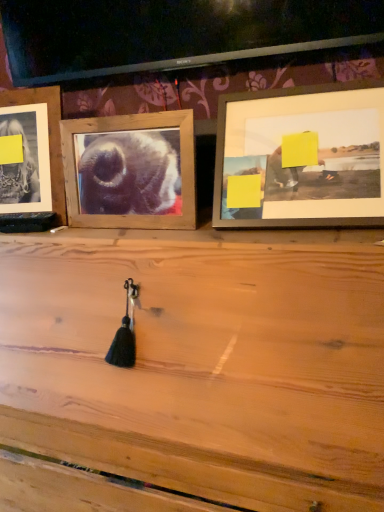
Describe the element at coordinates (49, 135) in the screenshot. I see `wooden frame at left, the third picture frame in the right-to-left sequence` at that location.

What is the approximate width of wooden frame at left, the third picture frame in the right-to-left sequence?

wooden frame at left, the third picture frame in the right-to-left sequence, is 7.25 inches in width.

This screenshot has width=384, height=512. I want to click on wooden picture frame at upper right, which appears as the first picture frame when viewed from the right, so click(x=301, y=157).

How many degrees apart are the facing directions of wooden picture frame at upper right, which appears as the first picture frame when viewed from the right, and wooden frame at left, the third picture frame in the right-to-left sequence?

They differ by 5.94 degrees in their facing directions.

Choose the correct answer: Is wooden picture frame at upper right, the third picture frame when ordered from left to right, inside wooden frame at left, the third picture frame in the right-to-left sequence, or outside it?

wooden picture frame at upper right, the third picture frame when ordered from left to right, is located beyond the bounds of wooden frame at left, the third picture frame in the right-to-left sequence.

Between wooden picture frame at upper right, which appears as the first picture frame when viewed from the right, and wooden frame at left, the third picture frame in the right-to-left sequence, which one has less height?

wooden picture frame at upper right, which appears as the first picture frame when viewed from the right, is shorter.

Which object is positioned more to the left, wooden picture frame at upper right, which appears as the first picture frame when viewed from the right, or wooden frame at left, the third picture frame in the right-to-left sequence?

wooden frame at left, the third picture frame in the right-to-left sequence.

Does wooden picture frame at upper right, which appears as the first picture frame when viewed from the right, have a greater height compared to wooden frame at center, placed as the 2th picture frame when sorted from right to left?

Yes, wooden picture frame at upper right, which appears as the first picture frame when viewed from the right, is taller than wooden frame at center, placed as the 2th picture frame when sorted from right to left.

Is wooden picture frame at upper right, which appears as the first picture frame when viewed from the right, thinner than wooden frame at center, placed as the 2th picture frame when sorted from right to left?

In fact, wooden picture frame at upper right, which appears as the first picture frame when viewed from the right, might be wider than wooden frame at center, placed as the 2th picture frame when sorted from right to left.

From a real-world perspective, between wooden picture frame at upper right, which appears as the first picture frame when viewed from the right, and wooden frame at center, placed as the 2th picture frame when sorted from right to left, who is vertically lower?

From a 3D spatial view, wooden frame at center, placed as the 2th picture frame when sorted from right to left, is below.

Is wooden picture frame at upper right, the third picture frame when ordered from left to right, positioned before wooden frame at center, placed as the 2th picture frame when sorted from right to left?

Yes.

Between wooden frame at center, placed as the 2th picture frame when sorted from right to left, and wooden frame at left, the 1th picture frame in the left-to-right sequence, which one has larger size?

wooden frame at left, the 1th picture frame in the left-to-right sequence, is bigger.

In terms of height, does wooden frame at center, the second picture frame from the left, look taller or shorter compared to wooden frame at left, the 1th picture frame in the left-to-right sequence?

Considering their sizes, wooden frame at center, the second picture frame from the left, has less height than wooden frame at left, the 1th picture frame in the left-to-right sequence.

From a real-world perspective, is wooden frame at center, placed as the 2th picture frame when sorted from right to left, located beneath wooden frame at left, the 1th picture frame in the left-to-right sequence?

Indeed, from a real-world perspective, wooden frame at center, placed as the 2th picture frame when sorted from right to left, is positioned beneath wooden frame at left, the 1th picture frame in the left-to-right sequence.

Which picture frame is the 2nd one when counting from the left side of the wooden picture frame at upper right, the third picture frame when ordered from left to right? Please provide its 2D coordinates.

[(49, 135)]

Does point (59, 123) come behind point (366, 187)?

Yes.

Is wooden frame at left, the 1th picture frame in the left-to-right sequence, wider or thinner than wooden picture frame at upper right, the third picture frame when ordered from left to right?

Clearly, wooden frame at left, the 1th picture frame in the left-to-right sequence, has less width compared to wooden picture frame at upper right, the third picture frame when ordered from left to right.

What's the angular difference between wooden frame at left, the third picture frame in the right-to-left sequence, and wooden frame at center, the second picture frame from the left,'s facing directions?

10.8 degrees separate the facing orientations of wooden frame at left, the third picture frame in the right-to-left sequence, and wooden frame at center, the second picture frame from the left.

Is wooden frame at left, the 1th picture frame in the left-to-right sequence, to the left or to the right of wooden frame at center, placed as the 2th picture frame when sorted from right to left, in the image?

wooden frame at left, the 1th picture frame in the left-to-right sequence, is to the left of wooden frame at center, placed as the 2th picture frame when sorted from right to left.

Can you see wooden frame at left, the 1th picture frame in the left-to-right sequence, touching wooden frame at center, the second picture frame from the left?

No.

Which of these two, wooden frame at left, the 1th picture frame in the left-to-right sequence, or wooden frame at center, the second picture frame from the left, is wider?

With larger width is wooden frame at left, the 1th picture frame in the left-to-right sequence.

Does wooden frame at center, placed as the 2th picture frame when sorted from right to left, have a smaller size compared to wooden picture frame at upper right, the third picture frame when ordered from left to right?

Indeed, wooden frame at center, placed as the 2th picture frame when sorted from right to left, has a smaller size compared to wooden picture frame at upper right, the third picture frame when ordered from left to right.

Find the location of a particular element. picture frame that appears on the right of wooden frame at center, placed as the 2th picture frame when sorted from right to left is located at coordinates (301, 157).

Does point (112, 162) come in front of point (326, 220)?

That is False.

From the image's perspective, would you say wooden frame at center, placed as the 2th picture frame when sorted from right to left, is shown under wooden picture frame at upper right, which appears as the first picture frame when viewed from the right?

Indeed, from the image's perspective, wooden frame at center, placed as the 2th picture frame when sorted from right to left, is shown beneath wooden picture frame at upper right, which appears as the first picture frame when viewed from the right.

The image size is (384, 512). I want to click on picture frame that is the 2nd one when counting backward from the wooden picture frame at upper right, the third picture frame when ordered from left to right, so click(49, 135).

This screenshot has width=384, height=512. Find the location of `picture frame located on the right of wooden frame at center, the second picture frame from the left`. picture frame located on the right of wooden frame at center, the second picture frame from the left is located at coordinates (301, 157).

Which object lies nearer to the anchor point wooden frame at left, the third picture frame in the right-to-left sequence, wooden frame at center, the second picture frame from the left, or wooden picture frame at upper right, the third picture frame when ordered from left to right?

wooden frame at center, the second picture frame from the left, lies closer to wooden frame at left, the third picture frame in the right-to-left sequence, than the other object.

Considering their positions, is wooden frame at center, placed as the 2th picture frame when sorted from right to left, positioned further to wooden picture frame at upper right, which appears as the first picture frame when viewed from the right, than wooden frame at left, the 1th picture frame in the left-to-right sequence?

wooden frame at left, the 1th picture frame in the left-to-right sequence.

Considering their positions, is wooden picture frame at upper right, the third picture frame when ordered from left to right, positioned further to wooden frame at center, placed as the 2th picture frame when sorted from right to left, than wooden frame at left, the 1th picture frame in the left-to-right sequence?

Based on the image, wooden picture frame at upper right, the third picture frame when ordered from left to right, appears to be further to wooden frame at center, placed as the 2th picture frame when sorted from right to left.

Based on their spatial positions, is wooden frame at left, the 1th picture frame in the left-to-right sequence, or wooden frame at center, placed as the 2th picture frame when sorted from right to left, closer to wooden picture frame at upper right, which appears as the first picture frame when viewed from the right?

wooden frame at center, placed as the 2th picture frame when sorted from right to left, is positioned closer to the anchor wooden picture frame at upper right, which appears as the first picture frame when viewed from the right.

From the image, which object appears to be farther from wooden frame at center, the second picture frame from the left, wooden frame at left, the third picture frame in the right-to-left sequence, or wooden picture frame at upper right, the third picture frame when ordered from left to right?

wooden picture frame at upper right, the third picture frame when ordered from left to right, lies further to wooden frame at center, the second picture frame from the left, than the other object.

When comparing their distances from wooden frame at left, the third picture frame in the right-to-left sequence, does wooden picture frame at upper right, which appears as the first picture frame when viewed from the right, or wooden frame at center, the second picture frame from the left, seem further?

wooden picture frame at upper right, which appears as the first picture frame when viewed from the right, is further to wooden frame at left, the third picture frame in the right-to-left sequence.

The width and height of the screenshot is (384, 512). What are the coordinates of `picture frame between wooden frame at left, the third picture frame in the right-to-left sequence, and wooden picture frame at upper right, which appears as the first picture frame when viewed from the right, in the horizontal direction` in the screenshot? It's located at (130, 170).